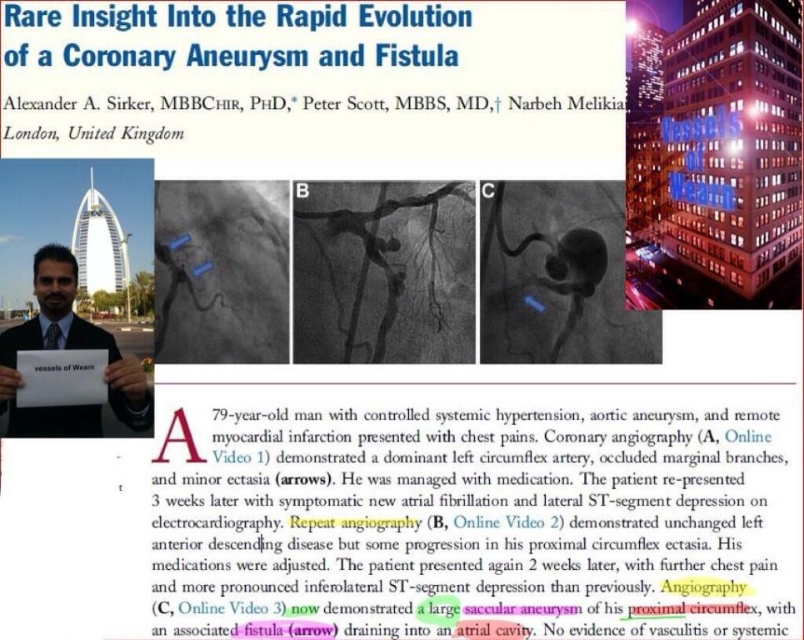
Question: Among these points, which one is farthest from the camera?

Choices:
 (A) (7, 401)
 (B) (690, 602)

Answer: (A)

Question: Which of the following is the closest to the observer?

Choices:
 (A) matte black suit at center
 (B) yellow highlighted text at center

Answer: (B)

Question: Can you confirm if yellow highlighted text at center is bigger than matte black suit at center?

Choices:
 (A) yes
 (B) no

Answer: (A)

Question: Is yellow highlighted text at center bigger than matte black suit at center?

Choices:
 (A) yes
 (B) no

Answer: (A)

Question: Which point is farther to the camera?

Choices:
 (A) yellow highlighted text at center
 (B) matte black suit at center

Answer: (B)

Question: Does yellow highlighted text at center appear on the right side of matte black suit at center?

Choices:
 (A) no
 (B) yes

Answer: (B)